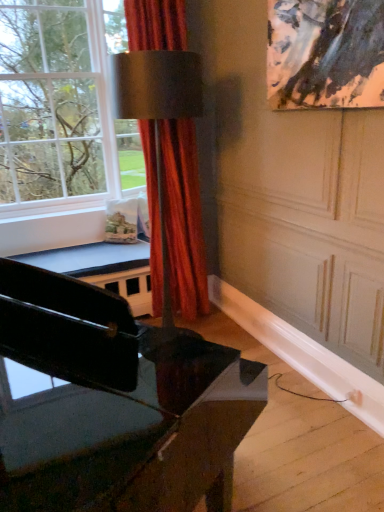
Question: Can you confirm if clear glass window at upper left is bigger than satin red curtain at center?

Choices:
 (A) yes
 (B) no

Answer: (A)

Question: Is clear glass window at upper left next to satin red curtain at center and touching it?

Choices:
 (A) yes
 (B) no

Answer: (B)

Question: Is satin red curtain at center completely or partially inside clear glass window at upper left?

Choices:
 (A) yes
 (B) no

Answer: (B)

Question: From the image's perspective, is clear glass window at upper left below satin red curtain at center?

Choices:
 (A) yes
 (B) no

Answer: (B)

Question: Is clear glass window at upper left facing away from satin red curtain at center?

Choices:
 (A) no
 (B) yes

Answer: (A)

Question: Considering the positions of black glossy piano at lower left and satin red curtain at center in the image, is black glossy piano at lower left bigger or smaller than satin red curtain at center?

Choices:
 (A) small
 (B) big

Answer: (B)

Question: In terms of height, does black glossy piano at lower left look taller or shorter compared to satin red curtain at center?

Choices:
 (A) tall
 (B) short

Answer: (B)

Question: Is black glossy piano at lower left to the left or to the right of satin red curtain at center in the image?

Choices:
 (A) right
 (B) left

Answer: (B)

Question: From a real-world perspective, is black glossy piano at lower left positioned above or below satin red curtain at center?

Choices:
 (A) above
 (B) below

Answer: (B)

Question: Considering the positions of clear glass window at upper left and satin red curtain at center in the image, is clear glass window at upper left taller or shorter than satin red curtain at center?

Choices:
 (A) tall
 (B) short

Answer: (B)

Question: In terms of width, does clear glass window at upper left look wider or thinner when compared to satin red curtain at center?

Choices:
 (A) thin
 (B) wide

Answer: (B)

Question: In the image, is clear glass window at upper left positioned in front of or behind satin red curtain at center?

Choices:
 (A) behind
 (B) front

Answer: (B)

Question: From the image's perspective, is clear glass window at upper left above or below satin red curtain at center?

Choices:
 (A) below
 (B) above

Answer: (B)

Question: Is clear glass window at upper left to the left or to the right of black glossy piano at lower left in the image?

Choices:
 (A) left
 (B) right

Answer: (A)

Question: In terms of height, does clear glass window at upper left look taller or shorter compared to black glossy piano at lower left?

Choices:
 (A) tall
 (B) short

Answer: (A)